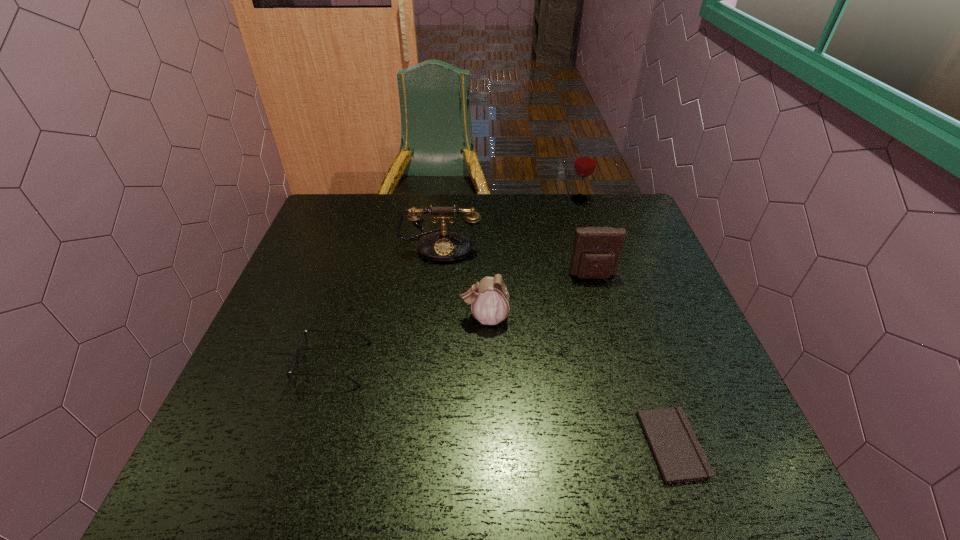
Identify the location of glass. coord(585,162).

At what (x,y) coordinates should I click in order to perform the action: click on the tallest object. Please return your answer as a coordinate pair (x, y). Looking at the image, I should click on (585, 162).

At what (x,y) coordinates should I click in order to perform the action: click on telephone. Please return your answer as a coordinate pair (x, y). The image size is (960, 540). Looking at the image, I should click on coord(444,246).

Identify the location of the third farthest object. (597, 250).

The width and height of the screenshot is (960, 540). I want to click on the farther pouch, so click(597, 250).

Locate an element on the screen. the left pouch is located at coordinates (489, 298).

Where is `the nearer pouch`? the nearer pouch is located at coordinates (489, 298).

Image resolution: width=960 pixels, height=540 pixels. What are the coordinates of `the fifth farthest object` in the screenshot? It's located at (304, 332).

Identify the location of spectacles. The image size is (960, 540). (304, 332).

The image size is (960, 540). Find the location of `the shortest object`. the shortest object is located at coordinates (680, 458).